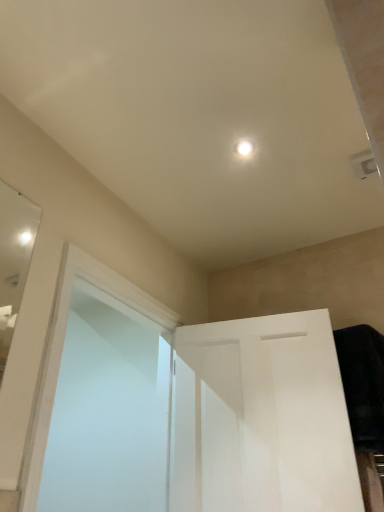
Question: Can you confirm if white matte door at center is smaller than frosted glass screen door at left?

Choices:
 (A) yes
 (B) no

Answer: (A)

Question: Is white matte door at center not within frosted glass screen door at left?

Choices:
 (A) yes
 (B) no

Answer: (A)

Question: Considering the relative positions of white matte door at center and frosted glass screen door at left in the image provided, is white matte door at center behind frosted glass screen door at left?

Choices:
 (A) yes
 (B) no

Answer: (A)

Question: Is the depth of white matte door at center less than that of frosted glass screen door at left?

Choices:
 (A) yes
 (B) no

Answer: (B)

Question: Does white matte door at center turn towards frosted glass screen door at left?

Choices:
 (A) no
 (B) yes

Answer: (A)

Question: Does white matte door at center have a lesser width compared to frosted glass screen door at left?

Choices:
 (A) no
 (B) yes

Answer: (B)

Question: From the image's perspective, is frosted glass screen door at left over white matte door at center?

Choices:
 (A) no
 (B) yes

Answer: (B)

Question: Is frosted glass screen door at left positioned before white matte door at center?

Choices:
 (A) yes
 (B) no

Answer: (A)

Question: Is frosted glass screen door at left at the left side of white matte door at center?

Choices:
 (A) yes
 (B) no

Answer: (A)

Question: Is frosted glass screen door at left beside white matte door at center?

Choices:
 (A) no
 (B) yes

Answer: (A)

Question: Can you confirm if frosted glass screen door at left is shorter than white matte door at center?

Choices:
 (A) yes
 (B) no

Answer: (B)

Question: Considering the relative positions of frosted glass screen door at left and white matte door at center in the image provided, is frosted glass screen door at left behind white matte door at center?

Choices:
 (A) yes
 (B) no

Answer: (B)

Question: Is frosted glass screen door at left spatially inside white matte door at center, or outside of it?

Choices:
 (A) inside
 (B) outside

Answer: (B)